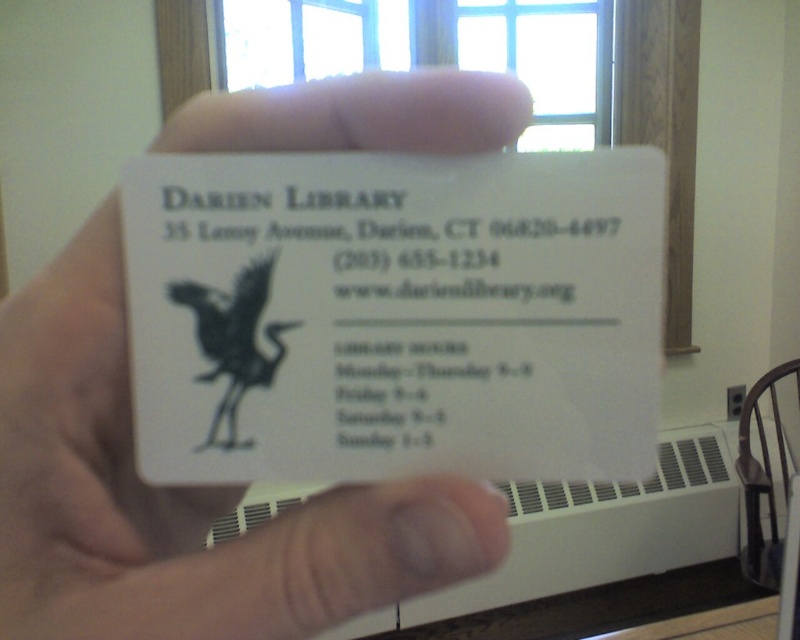
Question: Does white paper card at center have a larger size compared to black matte bird at center?

Choices:
 (A) no
 (B) yes

Answer: (B)

Question: Does white paper card at center have a lesser width compared to black matte bird at center?

Choices:
 (A) yes
 (B) no

Answer: (B)

Question: Can you confirm if white paper card at center is positioned to the right of white matte card at center?

Choices:
 (A) no
 (B) yes

Answer: (B)

Question: Which point appears farthest from the camera in this image?

Choices:
 (A) (41, 492)
 (B) (270, 276)

Answer: (B)

Question: Estimate the real-world distances between objects in this image. Which object is farther from the black matte bird at center?

Choices:
 (A) white matte card at center
 (B) white paper card at center

Answer: (B)

Question: Which point is closer to the camera?

Choices:
 (A) white matte card at center
 (B) black matte bird at center
 (C) white paper card at center

Answer: (A)